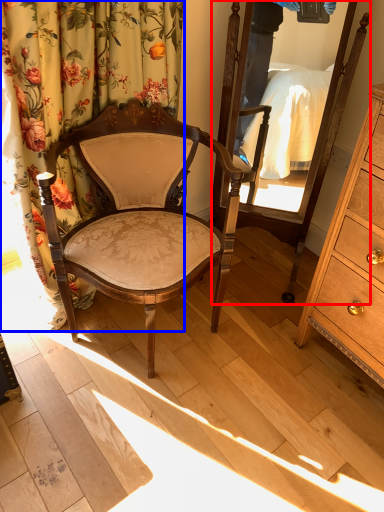
Question: Which object appears closest to the camera in this image, mirror (highlighted by a red box) or curtain (highlighted by a blue box)?

Choices:
 (A) mirror
 (B) curtain

Answer: (B)